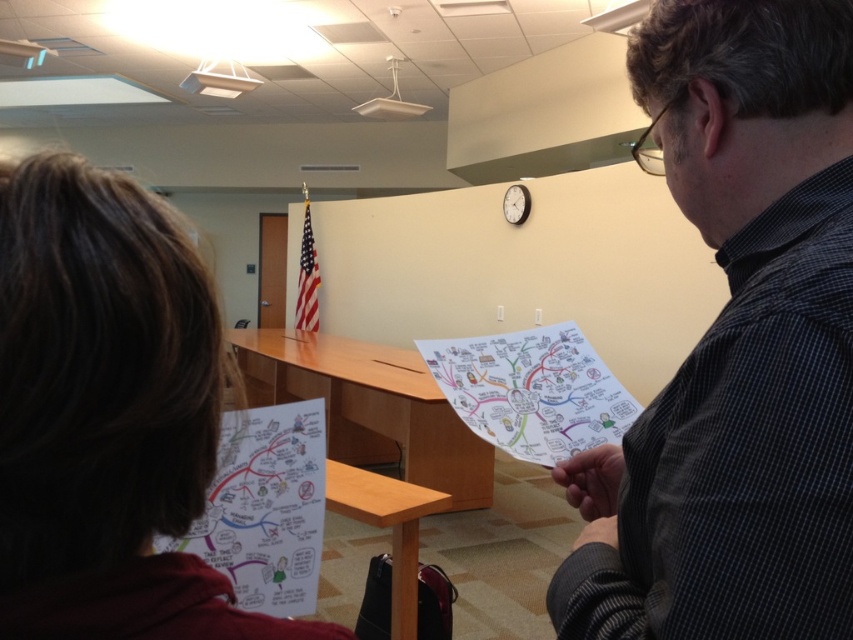
Is white paper map at lower left smaller than white paper map at center?

Incorrect, white paper map at lower left is not smaller in size than white paper map at center.

Is white paper map at lower left wider than white paper map at center?

No.

Find the location of a particular element. Image resolution: width=853 pixels, height=640 pixels. white paper map at lower left is located at coordinates (265, 508).

Is brown hair at left shorter than white paper map at center?

In fact, brown hair at left may be taller than white paper map at center.

Between point (15, 358) and point (497, 433), which one is positioned behind?

Point (497, 433)

Between point (65, 630) and point (552, 417), which one is positioned in front?

Positioned in front is point (65, 630).

This screenshot has height=640, width=853. In order to click on brown hair at left in this screenshot , I will do `click(108, 413)`.

Can you confirm if dark gray checkered shirt at right is positioned below white paper map at lower left?

No.

Who is taller, dark gray checkered shirt at right or white paper map at lower left?

dark gray checkered shirt at right is taller.

Locate an element on the screen. This screenshot has height=640, width=853. dark gray checkered shirt at right is located at coordinates (737, 348).

At what (x,y) coordinates should I click in order to perform the action: click on dark gray checkered shirt at right. Please return your answer as a coordinate pair (x, y). The width and height of the screenshot is (853, 640). Looking at the image, I should click on (737, 348).